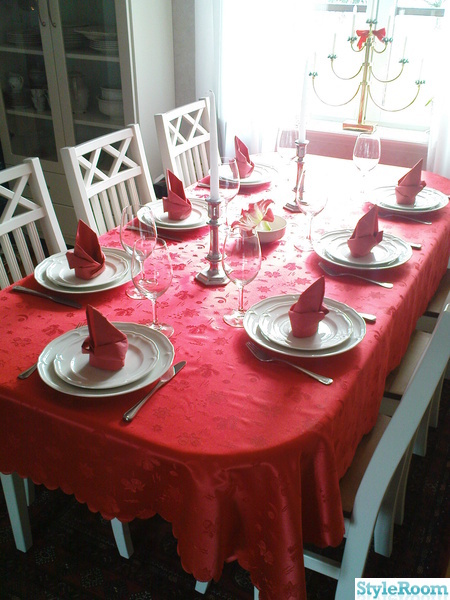
Locate an element on the screen. x on chair backrest is located at coordinates (122, 155), (93, 168), (17, 197), (175, 132), (195, 124).